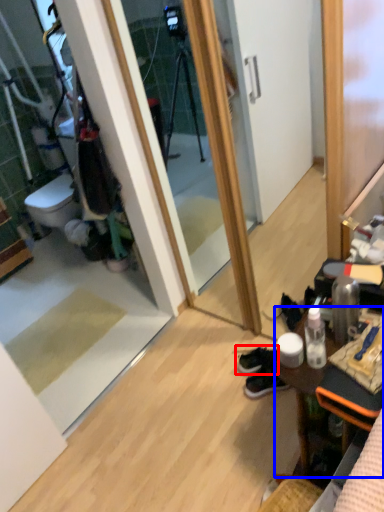
Question: Which object is closer to the camera taking this photo, footwear (highlighted by a red box) or desk (highlighted by a blue box)?

Choices:
 (A) footwear
 (B) desk

Answer: (B)